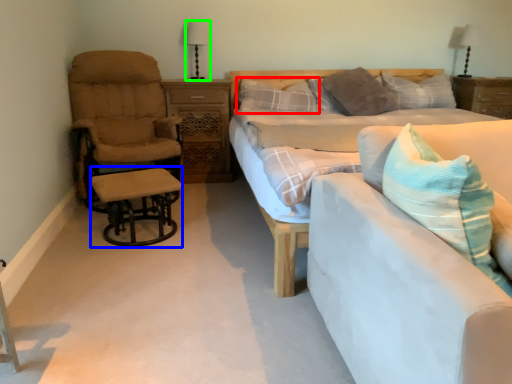
Question: Which object is the farthest from pillow (highlighted by a red box)? Choose among these: table (highlighted by a blue box) or table lamp (highlighted by a green box).

Choices:
 (A) table
 (B) table lamp

Answer: (A)